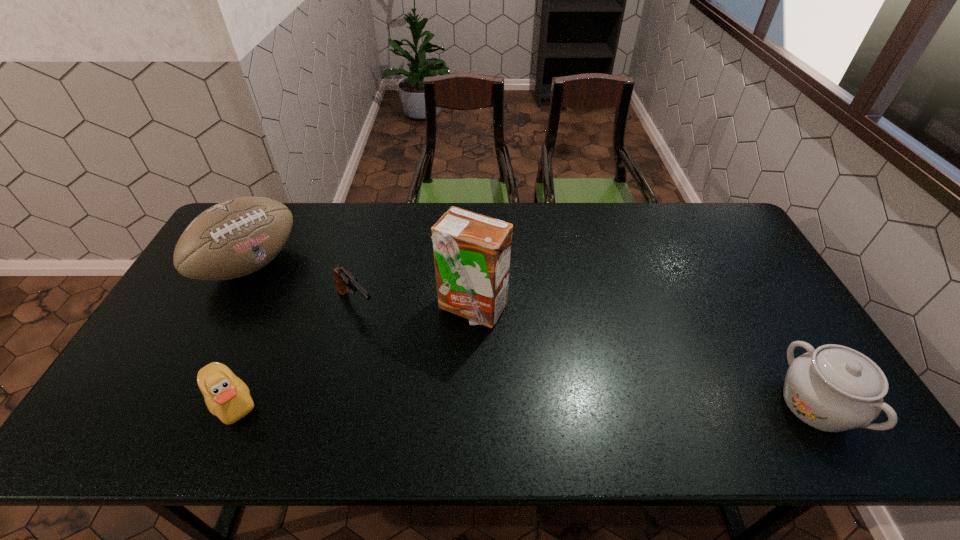
Identify the location of object located in the left edge section of the desktop. This screenshot has width=960, height=540. (237, 237).

Where is `object at the right edge`? object at the right edge is located at coordinates (834, 388).

Where is `object located in the far left corner section of the desktop`? This screenshot has width=960, height=540. object located in the far left corner section of the desktop is located at coordinates (237, 237).

At what (x,y) coordinates should I click in order to perform the action: click on object that is at the near right corner. Please return your answer as a coordinate pair (x, y). Looking at the image, I should click on (834, 388).

Where is `vacant region at the far edge of the desktop`? Image resolution: width=960 pixels, height=540 pixels. vacant region at the far edge of the desktop is located at coordinates (345, 211).

In the image, there is a desktop. Identify the location of free region at the near edge. The width and height of the screenshot is (960, 540). (523, 382).

In order to click on blank space at the right edge in this screenshot , I will do tap(731, 259).

Locate an element on the screen. vacant space at the near left corner of the desktop is located at coordinates [161, 384].

Find the location of `vacant space in between the duck and the rightmost object`. vacant space in between the duck and the rightmost object is located at coordinates [x=523, y=403].

Find the location of a particular element. This screenshot has width=960, height=540. vacant area that lies between the third shortest object and the football (American) is located at coordinates (533, 335).